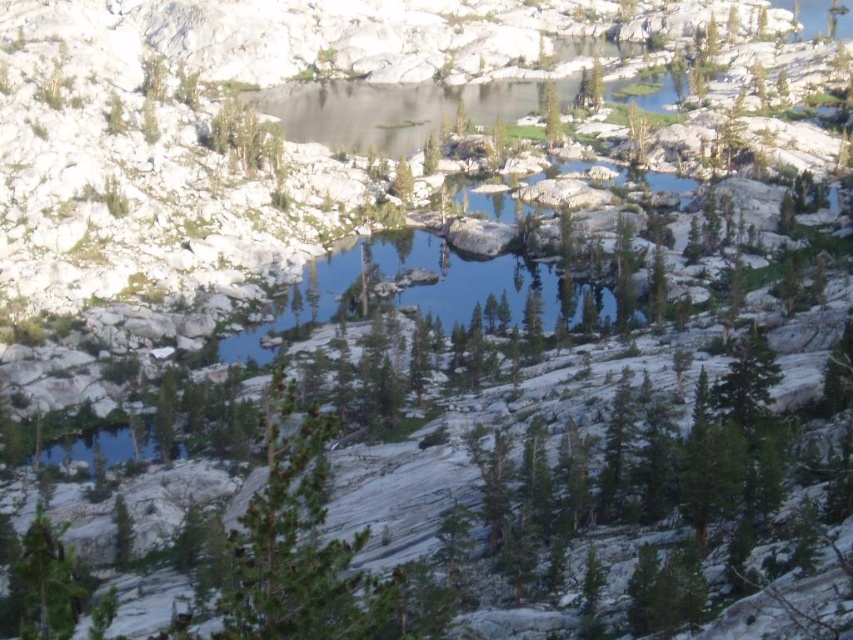
You are a hiker trying to navigate through the mountainous landscape. You see the green textured pine tree at center and the green matte tree at lower left. Which tree would appear closer to you as you look at the scene?

The green textured pine tree at center appears closer to you because it is positioned further to the viewer than the green matte tree at lower left, meaning it is nearer in the scene.

You are a hiker trying to navigate through the mountainous terrain. You see a green textured pine tree at center and a green matte tree at lower left. Which tree is positioned higher up in the landscape?

The green textured pine tree at center is positioned higher up in the landscape than the green matte tree at lower left.

You are a hiker standing at the origin point of the coordinate system in this mountainous landscape. You want to reach the green textured pine tree at center. What are the coordinates you need to move towards?

The coordinates to reach the green textured pine tree at center are point (294, 545).